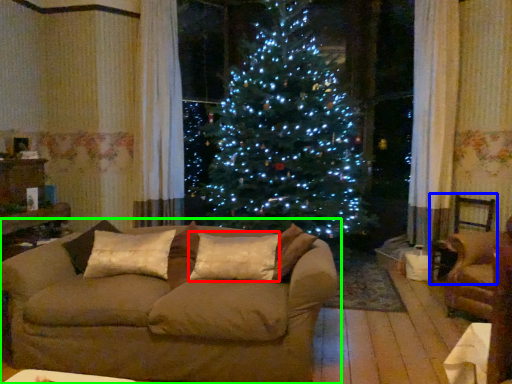
Question: Based on their relative distances, which object is farther from pillow (highlighted by a red box)? Choose from armchair (highlighted by a blue box) and studio couch (highlighted by a green box).

Choices:
 (A) armchair
 (B) studio couch

Answer: (A)